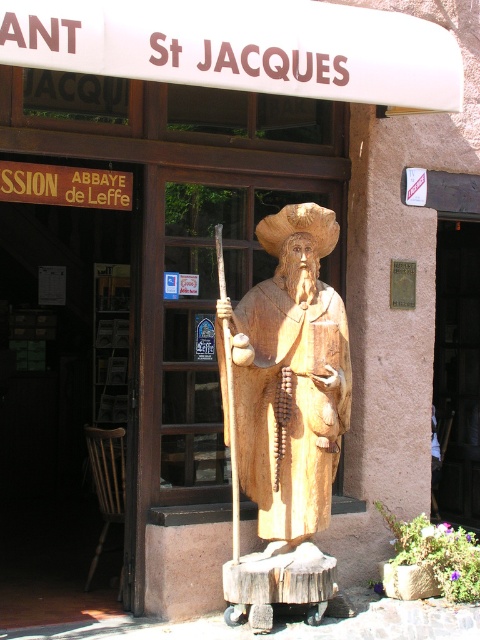
You are a visitor approaching the entrance of the building and see the wooden statue at center and the smooth stone door at center. Which object is closer to your right side as you face the entrance?

The smooth stone door at center is closer to your right side because the wooden statue at center is positioned on the left side of it.

You are standing in front of the statue of Saint Jacques. You notice two points marked on the statue. The first point is at coordinate (336, 371) and the second point is at coordinate (460, 227). Which point is closer to your current position?

Point (336, 371) is closer to the camera than point (460, 227), so the first point is closer to your current position.

You are holding a camera and want to take a photo of the wooden statue at center. If you are standing 5.08 meters away from it, will you be able to capture the entire statue in your shot without moving closer? Please explain your reasoning.

The wooden statue at center is 5.08 meters away from the camera. To determine if it can be captured entirely, you need to consider the camera lens. A standard lens with a 50mm focal length typically has a field of view that can capture objects at this distance. However, if the statue is very tall or wide, you might need a wider lens. Without specific dimensions of the statue, it is difficult to confirm, but the distance itself is feasible for capturing the entire statue.